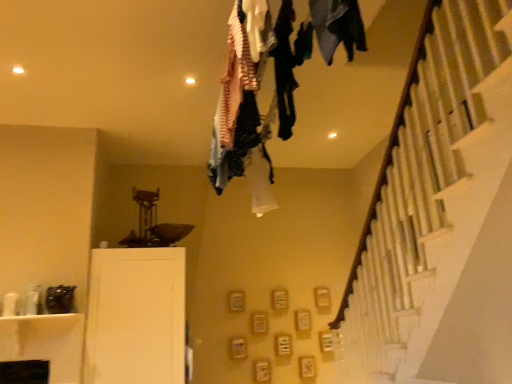
Where is `white matte cabinet at lower left`? This screenshot has width=512, height=384. white matte cabinet at lower left is located at coordinates (136, 316).

Measure the distance between white matte cabinet at lower left and camera.

The distance of white matte cabinet at lower left from camera is 3.20 meters.

This screenshot has width=512, height=384. What do you see at coordinates (136, 316) in the screenshot? I see `white matte cabinet at lower left` at bounding box center [136, 316].

What is the approximate height of white matte cabinet at lower left?

3.83 feet.

The width and height of the screenshot is (512, 384). Describe the element at coordinates (337, 27) in the screenshot. I see `dark blue fabric at upper center` at that location.

Where is `dark blue fabric at upper center`? dark blue fabric at upper center is located at coordinates (337, 27).

The height and width of the screenshot is (384, 512). In order to click on white matte cabinet at lower left in this screenshot , I will do pos(136,316).

Which object is positioned more to the left, white matte cabinet at lower left or dark blue fabric at upper center?

Positioned to the left is white matte cabinet at lower left.

Between white matte cabinet at lower left and dark blue fabric at upper center, which one is positioned in front?

Positioned in front is dark blue fabric at upper center.

Which is closer, (182, 376) or (330, 28)?

Clearly, point (182, 376) is more distant from the camera than point (330, 28).

From the image's perspective, which one is positioned higher, white matte cabinet at lower left or dark blue fabric at upper center?

dark blue fabric at upper center appears higher in the image.

From a real-world perspective, who is located higher, white matte cabinet at lower left or dark blue fabric at upper center?

dark blue fabric at upper center, from a real-world perspective.

Is white matte cabinet at lower left wider than dark blue fabric at upper center?

Correct, the width of white matte cabinet at lower left exceeds that of dark blue fabric at upper center.

Who is shorter, white matte cabinet at lower left or dark blue fabric at upper center?

dark blue fabric at upper center.

Is white matte cabinet at lower left smaller than dark blue fabric at upper center?

Actually, white matte cabinet at lower left might be larger than dark blue fabric at upper center.

Does white matte cabinet at lower left contain dark blue fabric at upper center?

No, dark blue fabric at upper center is not inside white matte cabinet at lower left.

Would you consider white matte cabinet at lower left to be distant from dark blue fabric at upper center?

That's right, there is a large distance between white matte cabinet at lower left and dark blue fabric at upper center.

Based on the photo, could you tell me if white matte cabinet at lower left is facing dark blue fabric at upper center?

Yes, white matte cabinet at lower left is aimed at dark blue fabric at upper center.

How many degrees apart are the facing directions of white matte cabinet at lower left and dark blue fabric at upper center?

white matte cabinet at lower left and dark blue fabric at upper center are facing 90.7 degrees away from each other.

Find the location of a particular element. clothing in front of the white matte cabinet at lower left is located at coordinates (337, 27).

Which object is positioned more to the left, dark blue fabric at upper center or white matte cabinet at lower left?

white matte cabinet at lower left is more to the left.

Considering the relative positions of dark blue fabric at upper center and white matte cabinet at lower left in the image provided, is dark blue fabric at upper center behind white matte cabinet at lower left?

No.

Which is in front, point (332, 9) or point (96, 321)?

The point (332, 9) is closer.

From the image's perspective, which object appears higher, dark blue fabric at upper center or white matte cabinet at lower left?

From the image's view, dark blue fabric at upper center is above.

From a real-world perspective, between dark blue fabric at upper center and white matte cabinet at lower left, who is vertically lower?

In real-world perspective, white matte cabinet at lower left is lower.

Can you confirm if dark blue fabric at upper center is wider than white matte cabinet at lower left?

Incorrect, the width of dark blue fabric at upper center does not surpass that of white matte cabinet at lower left.

Can you confirm if dark blue fabric at upper center is shorter than white matte cabinet at lower left?

Correct, dark blue fabric at upper center is not as tall as white matte cabinet at lower left.

Is dark blue fabric at upper center bigger than white matte cabinet at lower left?

Incorrect, dark blue fabric at upper center is not larger than white matte cabinet at lower left.

Can we say dark blue fabric at upper center lies outside white matte cabinet at lower left?

Yes.

Is dark blue fabric at upper center far from white matte cabinet at lower left?

Yes, dark blue fabric at upper center and white matte cabinet at lower left are quite far apart.

Is dark blue fabric at upper center turned away from white matte cabinet at lower left?

No, white matte cabinet at lower left is not at the back of dark blue fabric at upper center.

How many degrees apart are the facing directions of dark blue fabric at upper center and white matte cabinet at lower left?

They differ by 90.7 degrees in their facing directions.

How much distance is there between dark blue fabric at upper center and white matte cabinet at lower left?

dark blue fabric at upper center and white matte cabinet at lower left are 8.31 feet apart.

I want to click on clothing on the right of the white matte cabinet at lower left, so click(337, 27).

This screenshot has width=512, height=384. In order to click on clothing above the white matte cabinet at lower left (from the image's perspective) in this screenshot , I will do `click(337, 27)`.

You are a GUI agent. You are given a task and a screenshot of the screen. Output one action in this format:
    pyautogui.click(x=<x>, y=<y>)
    Task: Click on the furniture that appears on the left of dark blue fabric at upper center
    
    Given the screenshot: What is the action you would take?
    pyautogui.click(x=136, y=316)